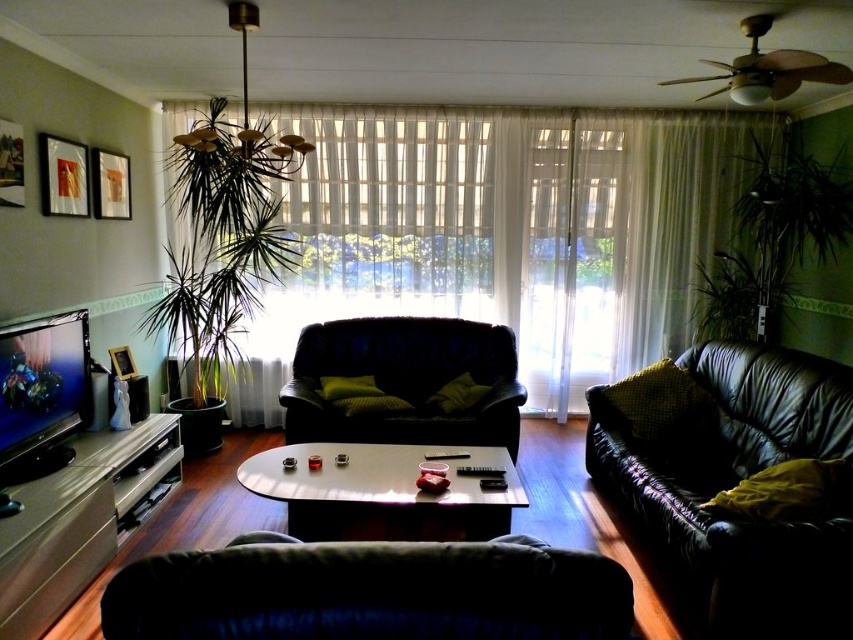
Question: Which object is positioned closest to the green leafy plant at right?

Choices:
 (A) velvet green armchair at center
 (B) black leather couch at right

Answer: (B)

Question: Can you confirm if black leather couch at right is positioned to the right of wooden picture frame at upper left?

Choices:
 (A) yes
 (B) no

Answer: (A)

Question: In this image, where is black leather couch at right located relative to dark green leather couch at lower center?

Choices:
 (A) right
 (B) left

Answer: (A)

Question: Which object is the farthest from the wooden picture frame at upper left?

Choices:
 (A) matte gold picture frame at left
 (B) sheer white curtain at center
 (C) dark green leather couch at lower center

Answer: (C)

Question: Can you confirm if sheer white curtain at center is positioned to the right of velvet green armchair at center?

Choices:
 (A) yes
 (B) no

Answer: (A)

Question: Which of the following is the farthest from the observer?

Choices:
 (A) velvet green armchair at center
 (B) wooden picture frame at upper left
 (C) green leafy plant at left
 (D) sheer white curtain at center

Answer: (D)